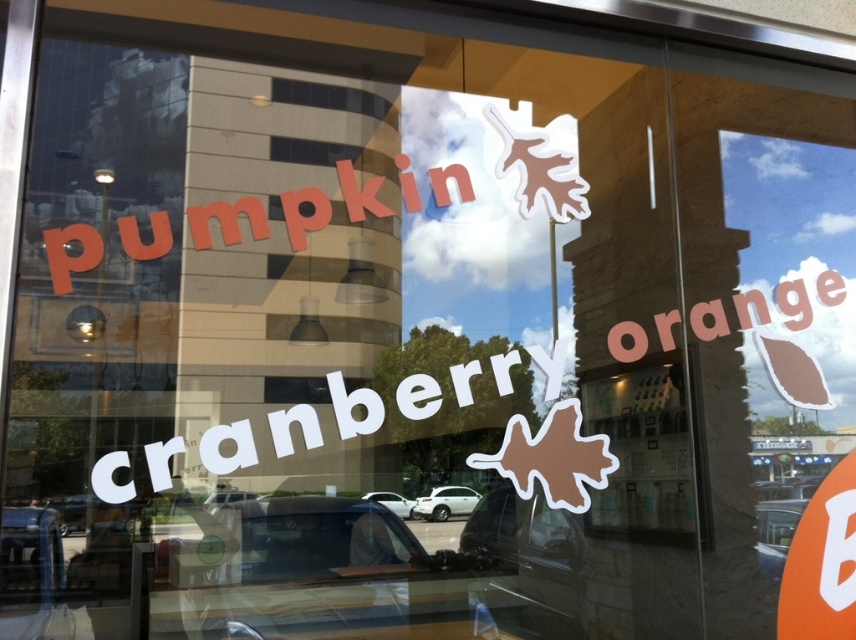
Question: Considering the relative positions of white matte cranberry at center and orange matte leaf at upper right in the image provided, where is white matte cranberry at center located with respect to orange matte leaf at upper right?

Choices:
 (A) below
 (B) above

Answer: (A)

Question: Which point is farther to the camera?

Choices:
 (A) (272, 422)
 (B) (758, 294)

Answer: (B)

Question: Which point is closer to the camera?

Choices:
 (A) (428, 417)
 (B) (308, 209)

Answer: (A)

Question: Can you confirm if white matte cranberry at center is positioned below orange matte leaf at upper right?

Choices:
 (A) yes
 (B) no

Answer: (A)

Question: Does white matte cranberry at center come behind pumpkin matte lettering at upper left?

Choices:
 (A) no
 (B) yes

Answer: (A)

Question: Which of these objects is positioned closest to the white matte cranberry at center?

Choices:
 (A) pumpkin matte lettering at upper left
 (B) orange matte leaf at upper right

Answer: (A)